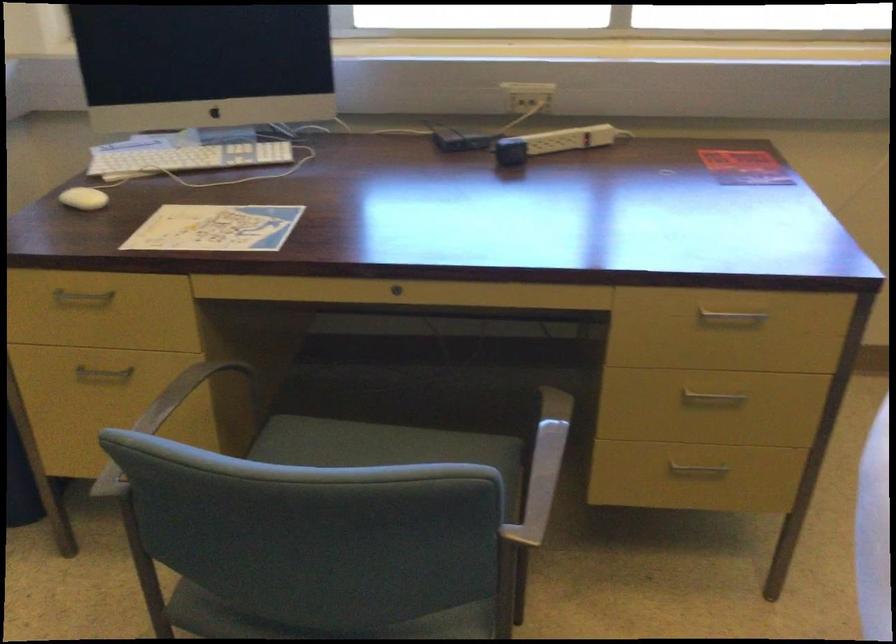
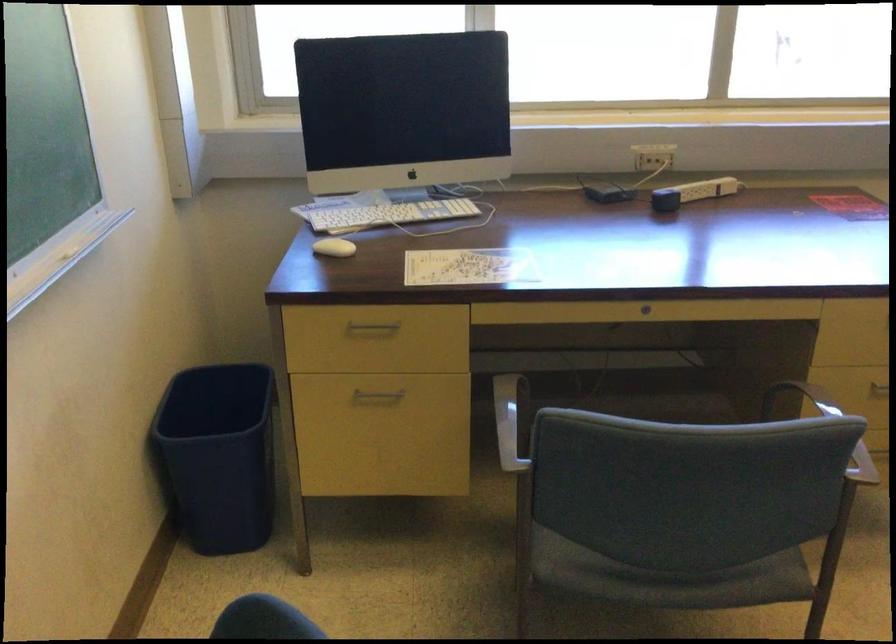
The point at [188,162] is marked in the first image. Where is the corresponding point in the second image?

(389, 214)